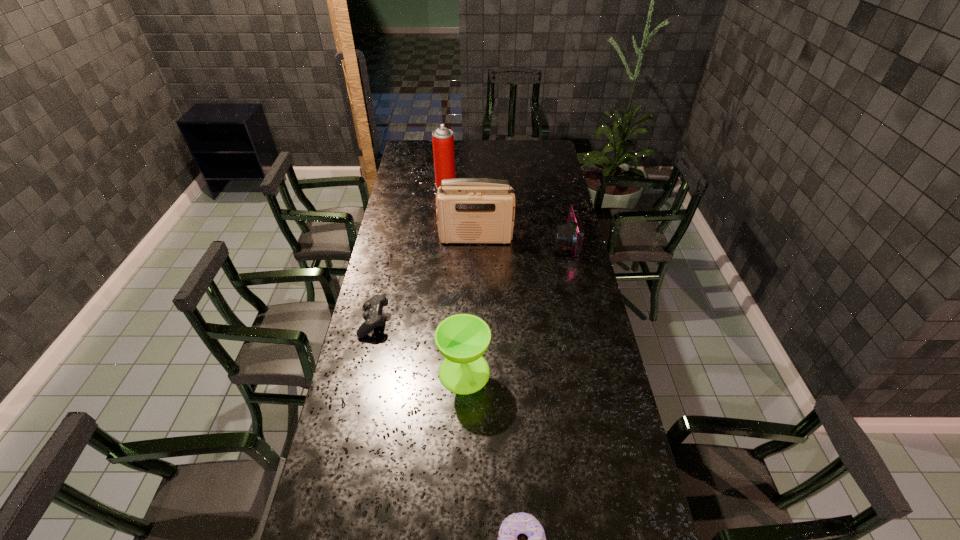
Identify the location of vacant area situated 0.320m on the front of the fifth farthest object. (460, 502).

The height and width of the screenshot is (540, 960). I want to click on vacant space positioned on the front-facing side of the camera, so click(528, 242).

In order to click on free space located 0.070m on the front-facing side of the camera in this screenshot , I will do `click(538, 242)`.

Where is `free space located 0.390m on the front-facing side of the camera`? free space located 0.390m on the front-facing side of the camera is located at coordinates (464, 242).

Locate an element on the screen. vacant space located 0.170m on the front of the fifth tallest object is located at coordinates (361, 382).

At what (x,y) coordinates should I click in order to perform the action: click on object that is at the left edge. Please return your answer as a coordinate pair (x, y). This screenshot has height=540, width=960. Looking at the image, I should click on (373, 318).

Where is `object present at the right edge`? object present at the right edge is located at coordinates (571, 234).

Image resolution: width=960 pixels, height=540 pixels. I want to click on free spot at the far edge of the desktop, so click(524, 144).

Image resolution: width=960 pixels, height=540 pixels. I want to click on free location at the left edge, so click(342, 430).

The image size is (960, 540). In the image, there is a desktop. Find the location of `vacant space at the right edge`. vacant space at the right edge is located at coordinates (545, 172).